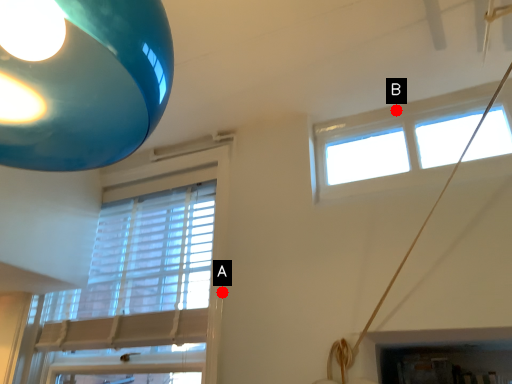
Question: Two points are circled on the image, labeled by A and B beside each circle. Which of the following is the closest to the observer?

Choices:
 (A) A is closer
 (B) B is closer

Answer: (A)